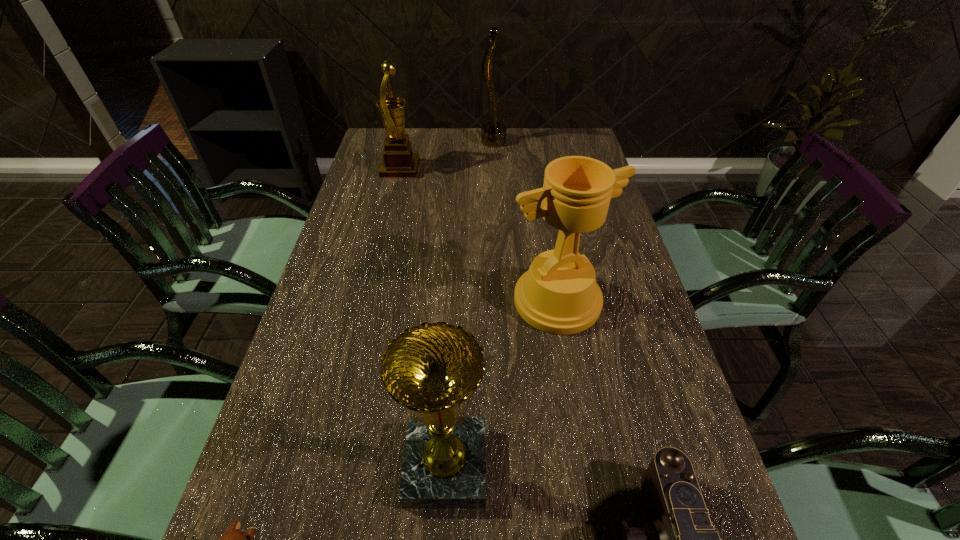
I want to click on the farthest object, so click(x=493, y=134).

Find the location of a particular element. the third farthest award is located at coordinates (559, 295).

Image resolution: width=960 pixels, height=540 pixels. I want to click on the second farthest award, so click(x=399, y=161).

I want to click on the leftmost award, so click(399, 161).

Find the location of a particular element. Image resolution: width=960 pixels, height=540 pixels. the nearest award is located at coordinates (432, 368).

What are the coordinates of `free spot located 0.210m on the front-facing side of the farthest award` in the screenshot? It's located at (425, 142).

What are the coordinates of `free location located on the front-facing side of the farthest award` in the screenshot? It's located at (457, 142).

This screenshot has width=960, height=540. I want to click on vacant space located 0.200m on the front-facing side of the farthest award, so click(428, 142).

Locate an element on the screen. The height and width of the screenshot is (540, 960). vacant space located on the back of the fourth nearest object is located at coordinates (541, 202).

The height and width of the screenshot is (540, 960). In order to click on vacant space located 0.070m on the front-facing side of the fifth nearest object in this screenshot , I will do `click(439, 168)`.